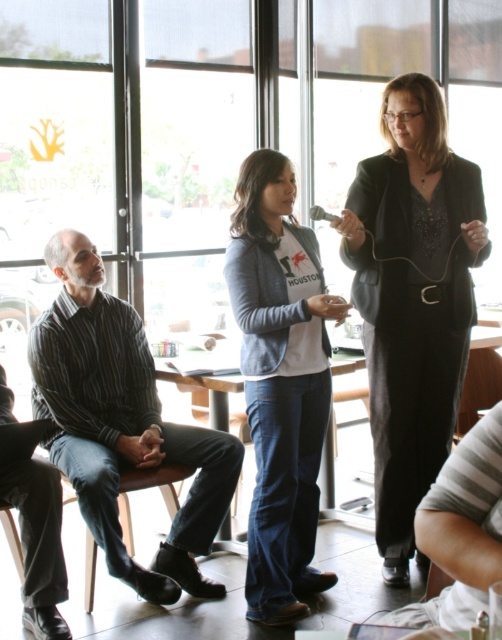
Can you confirm if black satin blazer at center is bigger than denim jeans at center?

Correct, black satin blazer at center is larger in size than denim jeans at center.

Is black satin blazer at center taller than denim jeans at center?

Indeed, black satin blazer at center has a greater height compared to denim jeans at center.

Describe the element at coordinates (412, 300) in the screenshot. I see `black satin blazer at center` at that location.

I want to click on black satin blazer at center, so click(412, 300).

This screenshot has width=502, height=640. What do you see at coordinates (120, 422) in the screenshot? I see `striped cotton shirt at left` at bounding box center [120, 422].

In the scene shown: Does striped cotton shirt at left appear on the left side of denim jeans at center?

Indeed, striped cotton shirt at left is positioned on the left side of denim jeans at center.

Who is more forward, (156, 580) or (293, 358)?

Positioned in front is point (293, 358).

At what (x,y) coordinates should I click in order to perform the action: click on striped cotton shirt at left. Please return your answer as a coordinate pair (x, y). The image size is (502, 640). Looking at the image, I should click on (120, 422).

Is black satin blazer at center wider than striped cotton shirt at left?

No, black satin blazer at center is not wider than striped cotton shirt at left.

Is black satin blazer at center in front of striped cotton shirt at left?

Yes.

You are a GUI agent. You are given a task and a screenshot of the screen. Output one action in this format:
    pyautogui.click(x=<x>, y=<y>)
    Task: Click on the black satin blazer at center
    
    Given the screenshot: What is the action you would take?
    pyautogui.click(x=412, y=300)